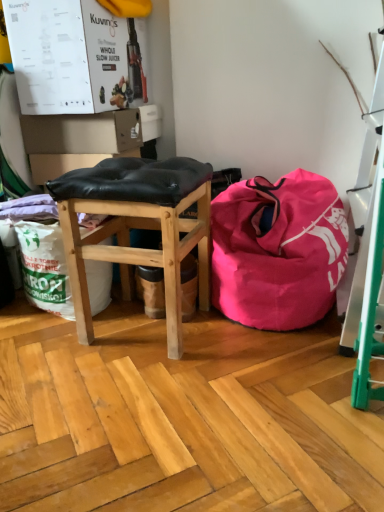
Question: Looking at their shapes, would you say black leather stool at center is wider or thinner than pink fabric bean bag at center?

Choices:
 (A) thin
 (B) wide

Answer: (A)

Question: Considering the positions of point (76, 202) and point (291, 246), is point (76, 202) closer or farther from the camera than point (291, 246)?

Choices:
 (A) closer
 (B) farther

Answer: (A)

Question: From a real-world perspective, is black leather stool at center physically located above or below pink fabric bean bag at center?

Choices:
 (A) below
 (B) above

Answer: (B)

Question: Does point (294, 298) appear closer or farther from the camera than point (155, 185)?

Choices:
 (A) farther
 (B) closer

Answer: (A)

Question: In terms of width, does pink fabric bean bag at center look wider or thinner when compared to black leather stool at center?

Choices:
 (A) thin
 (B) wide

Answer: (B)

Question: From the image's perspective, is pink fabric bean bag at center located above or below black leather stool at center?

Choices:
 (A) above
 (B) below

Answer: (A)

Question: From a real-world perspective, is pink fabric bean bag at center physically located above or below black leather stool at center?

Choices:
 (A) above
 (B) below

Answer: (B)